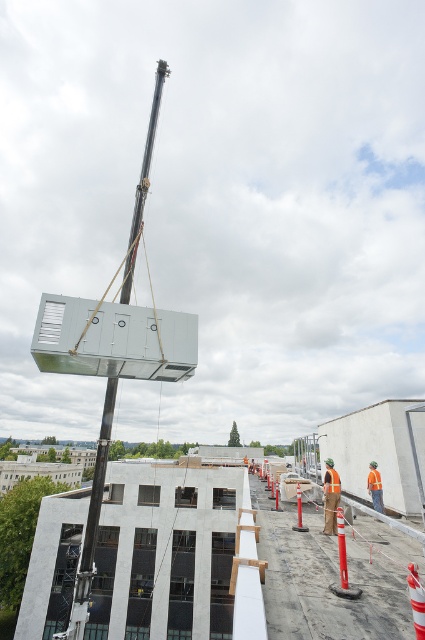
Who is shorter, orange plastic traffic cone at lower right or orange reflective traffic cone at center-right?

orange plastic traffic cone at lower right is shorter.

Does orange plastic traffic cone at lower right have a smaller size compared to orange reflective traffic cone at center-right?

Correct, orange plastic traffic cone at lower right occupies less space than orange reflective traffic cone at center-right.

Which is behind, point (343, 529) or point (300, 515)?

Point (300, 515)

Find the location of a particular element. The image size is (425, 640). orange plastic traffic cone at lower right is located at coordinates (342, 563).

Does concrete wall at center have a lesser height compared to orange reflective traffic cone at center-right?

No, concrete wall at center is not shorter than orange reflective traffic cone at center-right.

Does concrete wall at center have a lesser width compared to orange reflective traffic cone at center-right?

No.

The width and height of the screenshot is (425, 640). I want to click on concrete wall at center, so click(x=227, y=564).

Which is in front, point (416, 595) or point (305, 529)?

Point (416, 595)

Which is above, orange plastic traffic cone at center or orange reflective traffic cone at center-right?

Positioned higher is orange plastic traffic cone at center.

Is point (418, 630) more distant than point (300, 490)?

That is False.

Locate an element on the screen. orange plastic traffic cone at center is located at coordinates (416, 600).